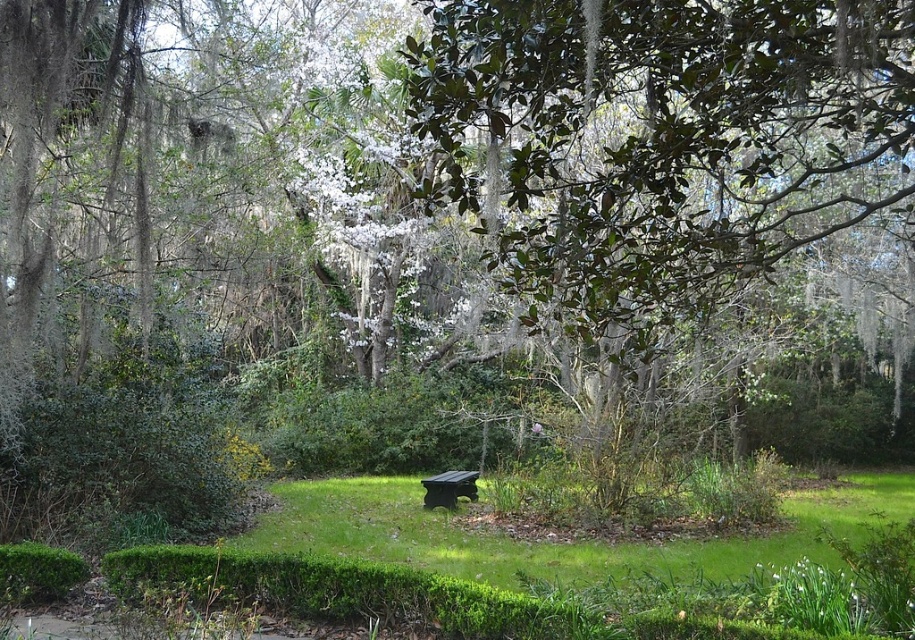
What do you see at coordinates (553, 538) in the screenshot?
I see `green grass at center` at bounding box center [553, 538].

Who is taller, green grass at center or green leafy hedge at center?

Standing taller between the two is green leafy hedge at center.

Find the location of `green grass at center`. green grass at center is located at coordinates (553, 538).

Find the location of a particular element. Image resolution: width=915 pixels, height=640 pixels. green grass at center is located at coordinates (553, 538).

Which of these two, green grass at center or dark brown wooden bench at center, stands shorter?

With less height is dark brown wooden bench at center.

Measure the distance between point (x=593, y=545) and camera.

Point (x=593, y=545) is 9.35 meters away from camera.

The width and height of the screenshot is (915, 640). What do you see at coordinates (553, 538) in the screenshot? I see `green grass at center` at bounding box center [553, 538].

The width and height of the screenshot is (915, 640). What are the coordinates of `green grass at center` in the screenshot? It's located at (553, 538).

Can you confirm if green leafy hedge at center is positioned below dark brown wooden bench at center?

Actually, green leafy hedge at center is above dark brown wooden bench at center.

Is point (420, 403) positioned in front of point (437, 474)?

That is False.

Which is behind, point (307, 454) or point (451, 496)?

The point (307, 454) is more distant.

You are a GUI agent. You are given a task and a screenshot of the screen. Output one action in this format:
    pyautogui.click(x=<x>, y=<y>)
    Task: Click on the green leafy hedge at center
    The height and width of the screenshot is (640, 915).
    Given the screenshot: What is the action you would take?
    pyautogui.click(x=395, y=426)